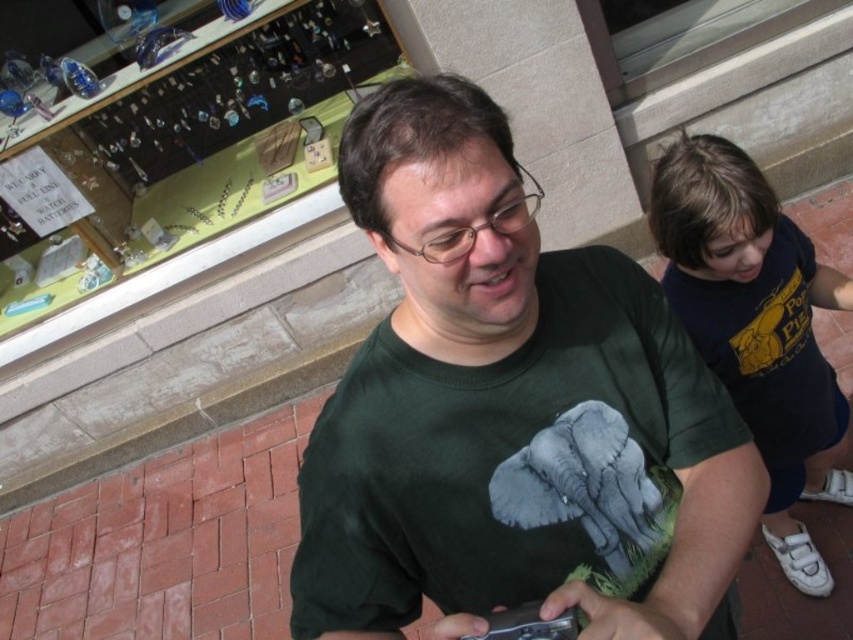
You are a photographer trying to capture a photo of the two points in the image. Which point, point (654, 573) or point (827, 365), will appear larger in your photo?

Point (654, 573) will appear larger in the photo because it is closer to the camera than point (827, 365).